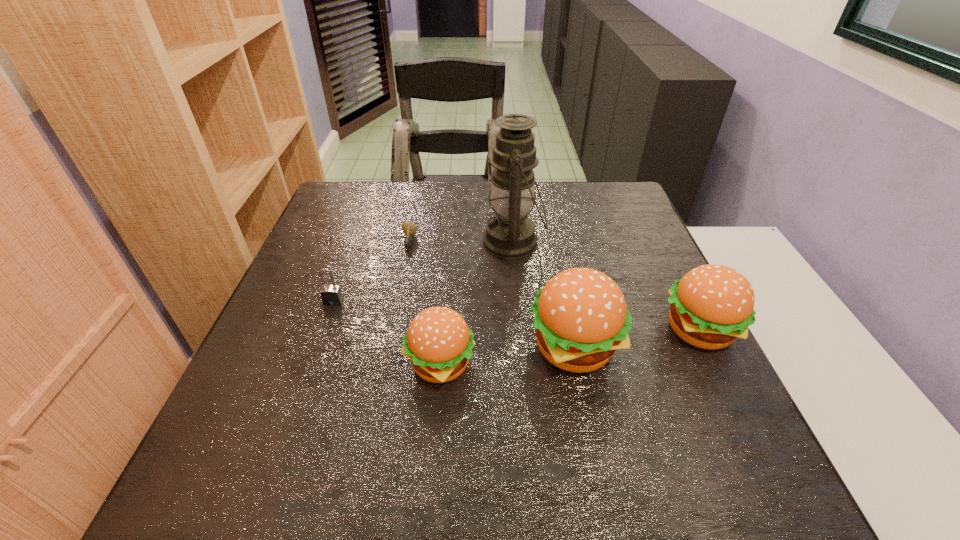
Identify the location of vacant point at the near edge. coord(568,433).

In the image, there is a desktop. In order to click on free space at the left edge in this screenshot , I will do `click(325, 379)`.

Image resolution: width=960 pixels, height=540 pixels. Find the location of `vacant space at the right edge of the desktop`. vacant space at the right edge of the desktop is located at coordinates (647, 247).

This screenshot has width=960, height=540. I want to click on vacant space at the far left corner of the desktop, so click(339, 205).

Where is `vacant space at the far right corner`? Image resolution: width=960 pixels, height=540 pixels. vacant space at the far right corner is located at coordinates (602, 210).

Find the location of `empty location between the second hamburger from right to left and the escargot`. empty location between the second hamburger from right to left and the escargot is located at coordinates (492, 295).

The image size is (960, 540). I want to click on vacant space in between the leftmost hamburger and the second hamburger from right to left, so click(x=507, y=356).

Find the location of a particular element. free spot between the tallest object and the fifth tallest object is located at coordinates (423, 272).

In order to click on unoccupied area between the rightmost object and the second shortest object in this screenshot , I will do `click(516, 316)`.

Locate an element on the screen. vacant point located between the second hamburger from left to right and the third shortest object is located at coordinates (507, 356).